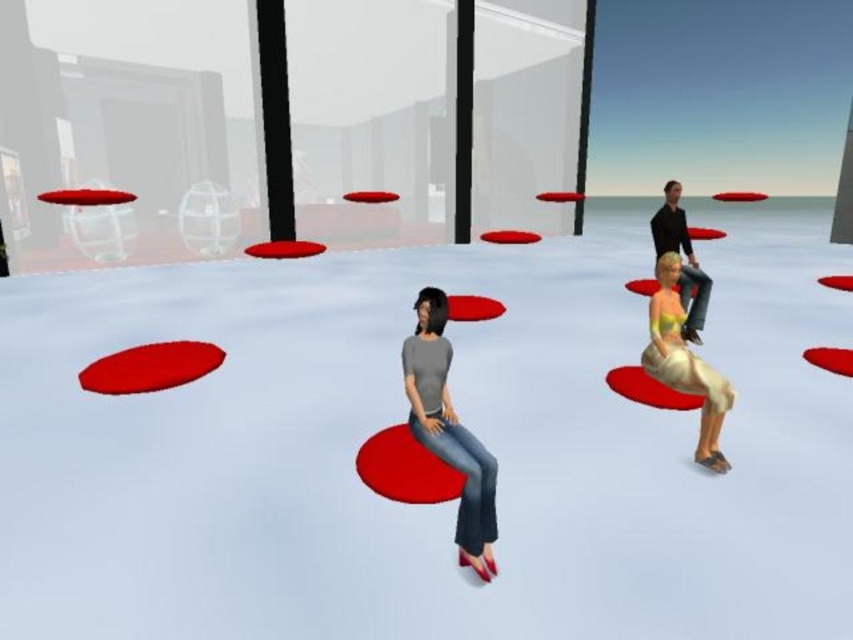
Question: Does matte gray shirt at center have a lesser width compared to beige fabric cushion at right?

Choices:
 (A) no
 (B) yes

Answer: (B)

Question: Which point appears farthest from the camera in this image?

Choices:
 (A) (453, 442)
 (B) (650, 348)

Answer: (B)

Question: Does matte gray shirt at center appear over beige fabric cushion at right?

Choices:
 (A) no
 (B) yes

Answer: (A)

Question: Estimate the real-world distances between objects in this image. Which object is farther from the matte gray shirt at center?

Choices:
 (A) matte black shirt at upper right
 (B) beige fabric cushion at right

Answer: (A)

Question: Which point is farther to the camera?

Choices:
 (A) matte black shirt at upper right
 (B) beige fabric cushion at right

Answer: (A)

Question: Is matte gray shirt at center smaller than matte black shirt at upper right?

Choices:
 (A) yes
 (B) no

Answer: (A)